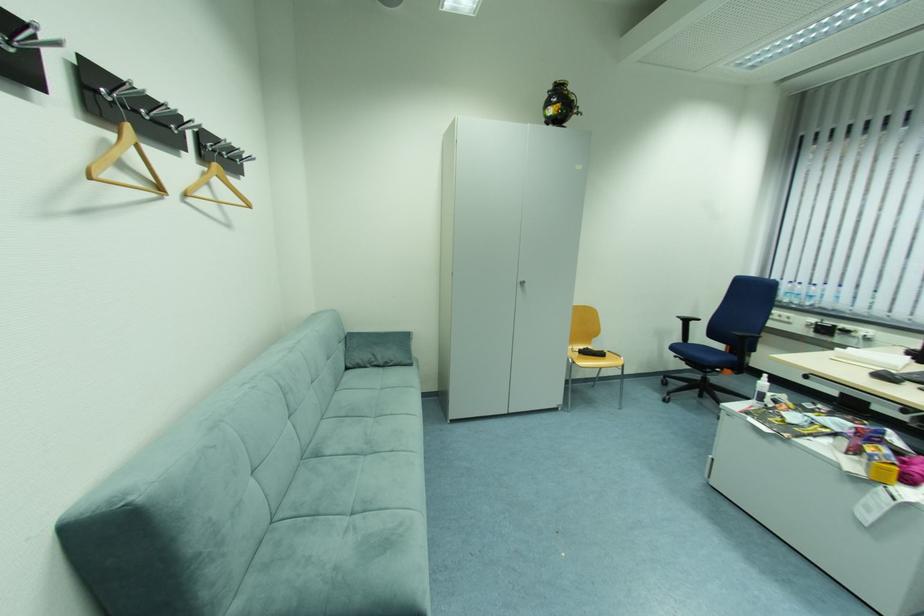
Where is `cabinet handle`? cabinet handle is located at coordinates (524, 285).